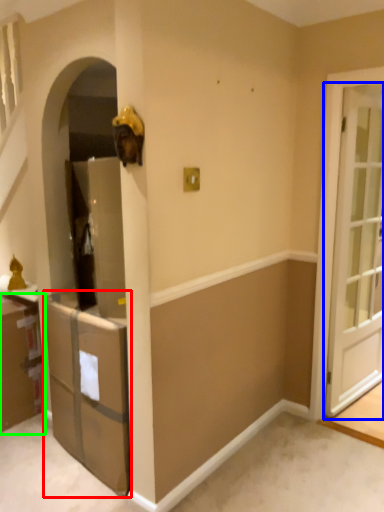
Question: Which is nearer to the cabinetry (highlighted by a red box)? door (highlighted by a blue box) or cabinetry (highlighted by a green box).

Choices:
 (A) door
 (B) cabinetry

Answer: (B)